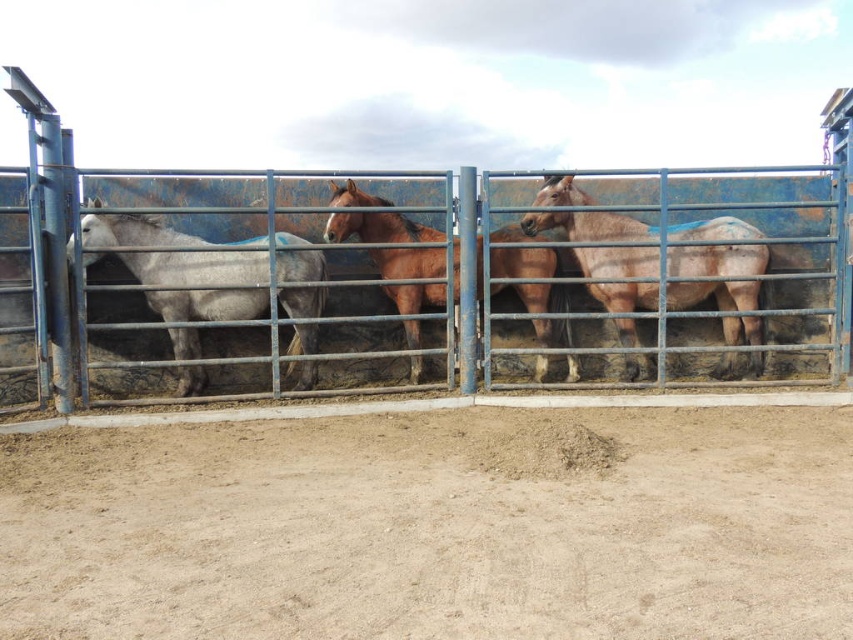
Between blue metal fence at center and brown matte horse at center, which one appears on the left side from the viewer's perspective?

brown matte horse at center is more to the left.

Is point (10, 380) positioned before point (757, 248)?

Yes, point (10, 380) is in front of point (757, 248).

You are a GUI agent. You are given a task and a screenshot of the screen. Output one action in this format:
    pyautogui.click(x=<x>, y=<y>)
    Task: Click on the blue metal fence at center
    
    Given the screenshot: What is the action you would take?
    pyautogui.click(x=677, y=284)

Can you confirm if blue metal fence at center is shorter than brown glossy horse at center?

Yes, blue metal fence at center is shorter than brown glossy horse at center.

Is blue metal fence at center to the right of brown glossy horse at center from the viewer's perspective?

Indeed, blue metal fence at center is positioned on the right side of brown glossy horse at center.

Between point (688, 195) and point (552, 250), which one is positioned behind?

The point (688, 195) is more distant.

The width and height of the screenshot is (853, 640). Find the location of `blue metal fence at center`. blue metal fence at center is located at coordinates (677, 284).

Is blue metal fence at center closer to the viewer compared to gray matte horse at left?

No, it is behind gray matte horse at left.

Describe the element at coordinates (677, 284) in the screenshot. I see `blue metal fence at center` at that location.

Image resolution: width=853 pixels, height=640 pixels. What do you see at coordinates (677, 284) in the screenshot?
I see `blue metal fence at center` at bounding box center [677, 284].

The image size is (853, 640). In order to click on blue metal fence at center in this screenshot , I will do `click(677, 284)`.